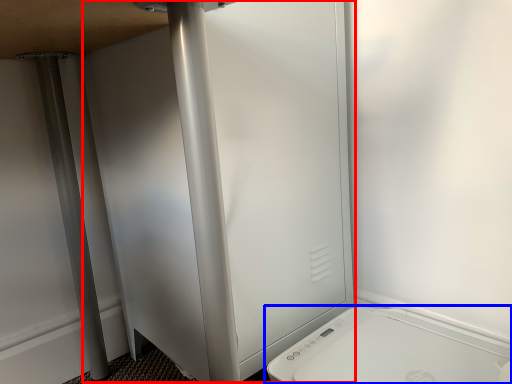
Question: Which object is closer to the camera taking this photo, screen door (highlighted by a red box) or home appliance (highlighted by a blue box)?

Choices:
 (A) screen door
 (B) home appliance

Answer: (B)